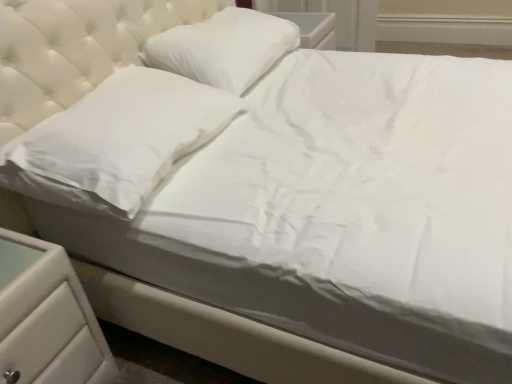
Question: Can you confirm if white plastic drawer at lower left is wider than white smooth pillow at upper center, the 2th pillow from the front?

Choices:
 (A) no
 (B) yes

Answer: (B)

Question: Is white plastic drawer at lower left smaller than white smooth pillow at upper center, positioned as the first pillow in back-to-front order?

Choices:
 (A) yes
 (B) no

Answer: (A)

Question: Considering the relative sizes of white plastic drawer at lower left and white smooth pillow at upper center, positioned as the first pillow in back-to-front order, in the image provided, is white plastic drawer at lower left taller than white smooth pillow at upper center, positioned as the first pillow in back-to-front order,?

Choices:
 (A) no
 (B) yes

Answer: (B)

Question: Is white plastic drawer at lower left closer to the viewer compared to white smooth pillow at upper center, the 2th pillow from the front?

Choices:
 (A) no
 (B) yes

Answer: (B)

Question: From the image's perspective, is white plastic drawer at lower left over white smooth pillow at upper center, the 2th pillow from the front?

Choices:
 (A) yes
 (B) no

Answer: (B)

Question: Considering the positions of white plastic drawer at lower left and white smooth pillow at upper center, positioned as the first pillow in back-to-front order, in the image, is white plastic drawer at lower left taller or shorter than white smooth pillow at upper center, positioned as the first pillow in back-to-front order,?

Choices:
 (A) short
 (B) tall

Answer: (B)

Question: Is point click(40, 283) positioned closer to the camera than point click(280, 21)?

Choices:
 (A) closer
 (B) farther

Answer: (A)

Question: From a real-world perspective, is white plastic drawer at lower left above or below white smooth pillow at upper center, the 2th pillow from the front?

Choices:
 (A) below
 (B) above

Answer: (A)

Question: Based on their sizes in the image, would you say white plastic drawer at lower left is bigger or smaller than white smooth pillow at upper center, the 2th pillow from the front?

Choices:
 (A) small
 (B) big

Answer: (A)

Question: Choose the correct answer: Is white smooth pillow at upper center, the 2th pillow from the front, inside white plastic drawer at lower left or outside it?

Choices:
 (A) outside
 (B) inside

Answer: (A)

Question: From a real-world perspective, relative to white plastic drawer at lower left, is white smooth pillow at upper center, positioned as the first pillow in back-to-front order, vertically above or below?

Choices:
 (A) above
 (B) below

Answer: (A)

Question: From their relative heights in the image, would you say white smooth pillow at upper center, the 2th pillow from the front, is taller or shorter than white plastic drawer at lower left?

Choices:
 (A) short
 (B) tall

Answer: (A)

Question: Is white smooth pillow at upper center, the 2th pillow from the front, wider or thinner than white plastic drawer at lower left?

Choices:
 (A) thin
 (B) wide

Answer: (A)

Question: In terms of width, does white smooth pillow at left, which appears as the second pillow when viewed from the back, look wider or thinner when compared to white plastic drawer at lower left?

Choices:
 (A) thin
 (B) wide

Answer: (A)

Question: Considering the positions of white smooth pillow at left, which appears as the second pillow when viewed from the back, and white plastic drawer at lower left in the image, is white smooth pillow at left, which appears as the second pillow when viewed from the back, taller or shorter than white plastic drawer at lower left?

Choices:
 (A) tall
 (B) short

Answer: (B)